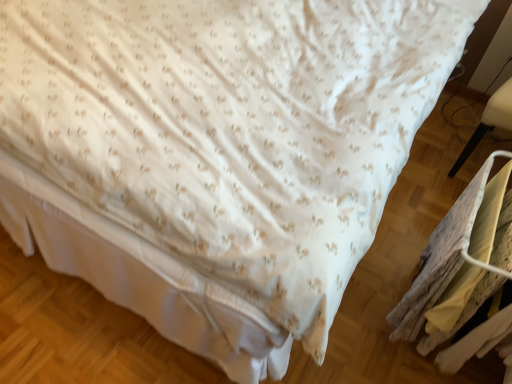
Question: From a real-world perspective, is white plastic chair at right above or below yellow fabric laundry at lower right?

Choices:
 (A) below
 (B) above

Answer: (B)

Question: Is point (500, 97) closer or farther from the camera than point (416, 321)?

Choices:
 (A) closer
 (B) farther

Answer: (B)

Question: Is white plastic chair at right in front of or behind yellow fabric laundry at lower right in the image?

Choices:
 (A) front
 (B) behind

Answer: (B)

Question: In the image, is yellow fabric laundry at lower right positioned in front of or behind white plastic chair at right?

Choices:
 (A) front
 (B) behind

Answer: (A)

Question: Is yellow fabric laundry at lower right bigger or smaller than white plastic chair at right?

Choices:
 (A) small
 (B) big

Answer: (A)

Question: In the image, is yellow fabric laundry at lower right on the left side or the right side of white plastic chair at right?

Choices:
 (A) right
 (B) left

Answer: (B)

Question: From a real-world perspective, is yellow fabric laundry at lower right physically located above or below white plastic chair at right?

Choices:
 (A) below
 (B) above

Answer: (A)